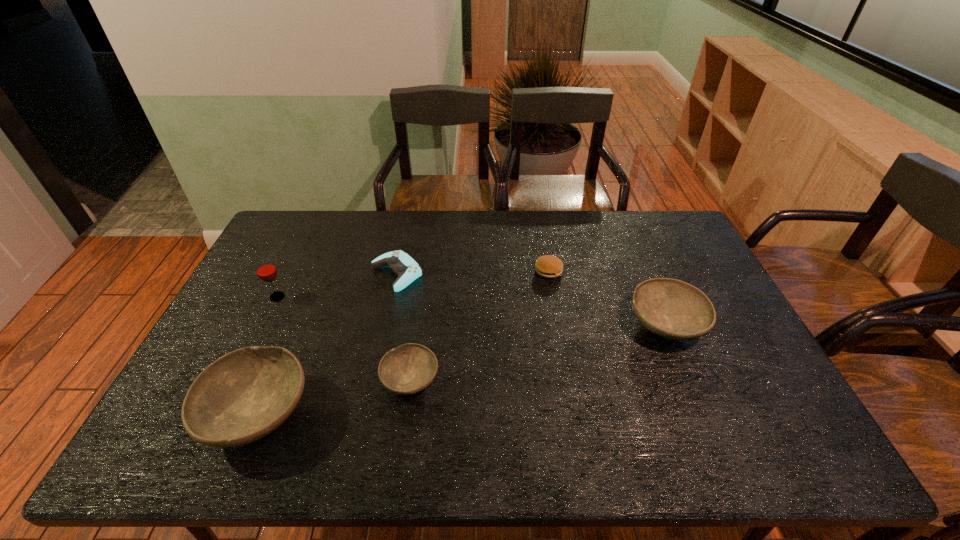
The height and width of the screenshot is (540, 960). Identify the location of free spot between the control and the tallest object. (337, 285).

Find the location of `empty location between the second object from right to left and the leftmost bowl`. empty location between the second object from right to left and the leftmost bowl is located at coordinates (403, 342).

Image resolution: width=960 pixels, height=540 pixels. Find the location of `free space between the fourth tallest object and the glass`. free space between the fourth tallest object and the glass is located at coordinates [344, 338].

The height and width of the screenshot is (540, 960). In order to click on the fifth closest object to the second bowl from left to right in this screenshot , I will do `click(670, 308)`.

This screenshot has height=540, width=960. Find the location of `object that stands as the fourth closest to the second object from right to left`. object that stands as the fourth closest to the second object from right to left is located at coordinates (243, 396).

The image size is (960, 540). I want to click on bowl that can be found as the closest to the patty, so click(x=670, y=308).

This screenshot has width=960, height=540. I want to click on the third closest bowl relative to the glass, so click(670, 308).

Locate an element on the screen. free space that satisfies the following two spatial constraints: 1. on the back side of the patty; 2. on the right side of the control is located at coordinates (397, 271).

Locate an element on the screen. The image size is (960, 540). vacant space that satisfies the following two spatial constraints: 1. on the front side of the control; 2. on the right side of the farthest bowl is located at coordinates (386, 325).

Identify the location of free space that satisfies the following two spatial constraints: 1. on the front side of the tallest object; 2. on the left side of the third shortest object. This screenshot has width=960, height=540. (237, 380).